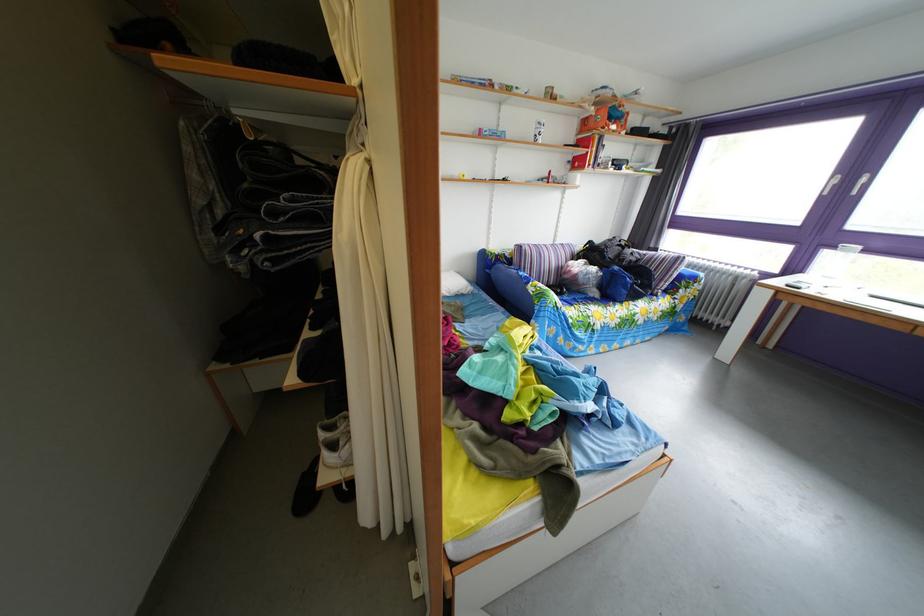
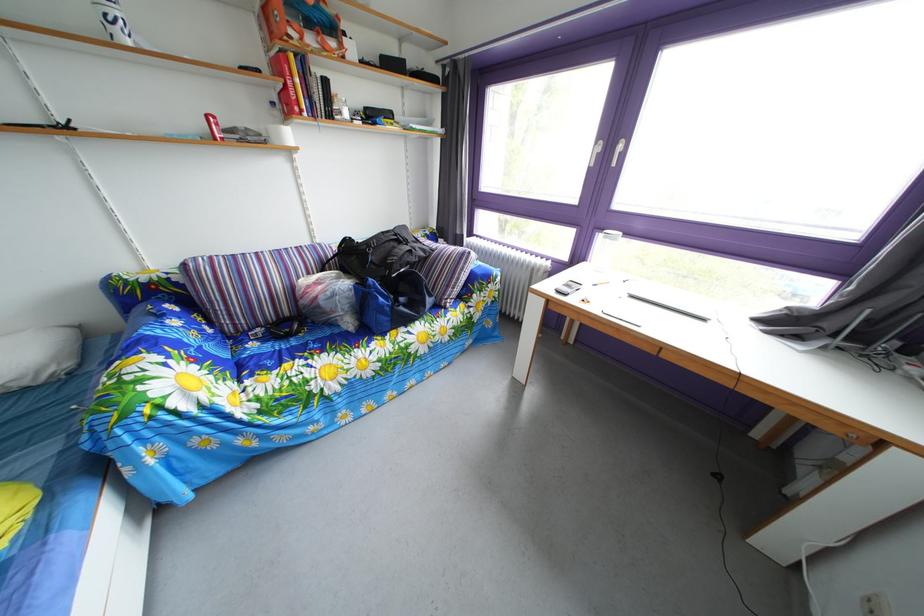
In a continuous first-person perspective shot, in which direction is the camera moving?

The movement direction of the cameraman is right, forward.